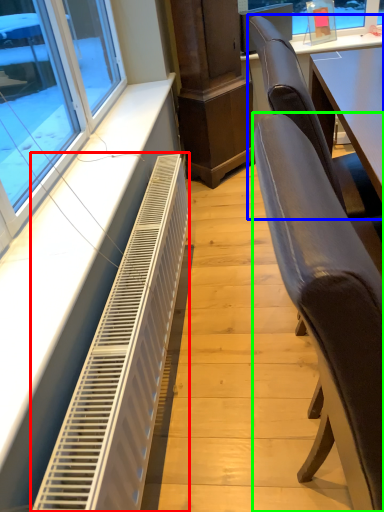
Question: Estimate the real-world distances between objects in this image. Which object is farther from air conditioning (highlighted by a red box), chair (highlighted by a blue box) or chair (highlighted by a green box)?

Choices:
 (A) chair
 (B) chair

Answer: (A)